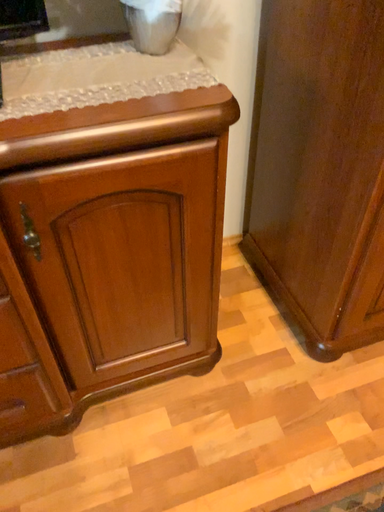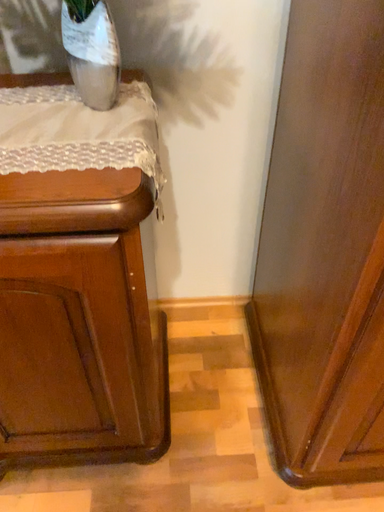
Question: Which way did the camera rotate in the video?

Choices:
 (A) rotated right
 (B) rotated left

Answer: (B)